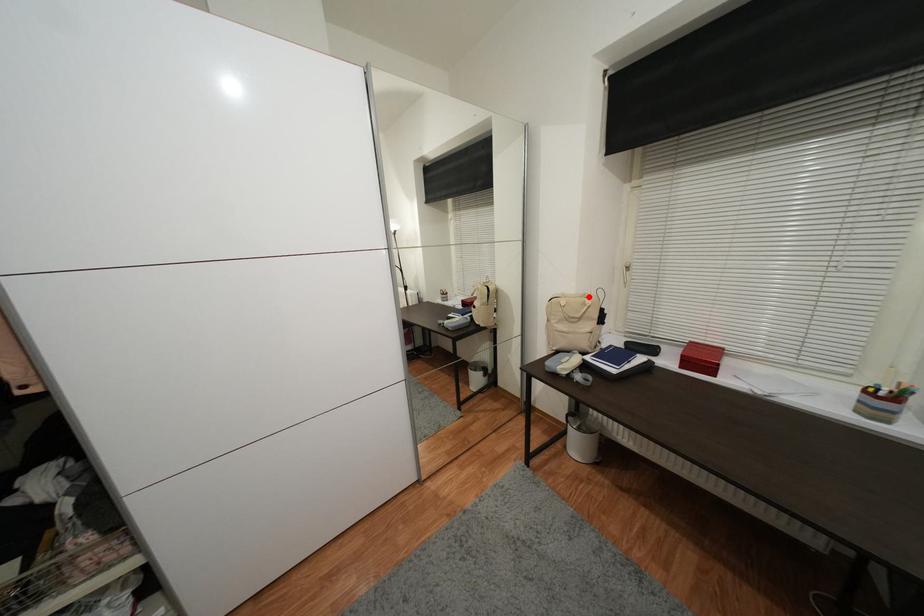
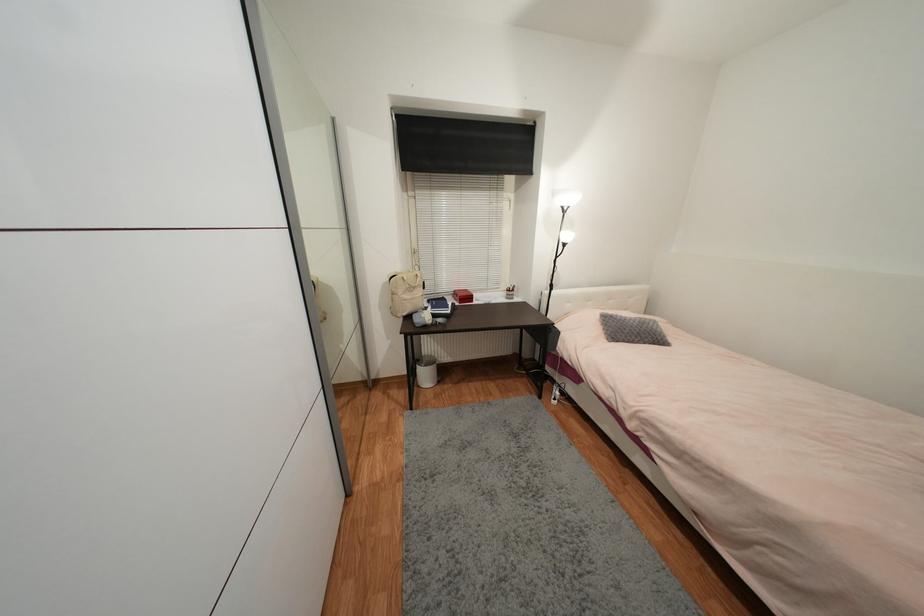
Where in the second image is the point corresponding to the highlighted location from the first image?

(412, 273)